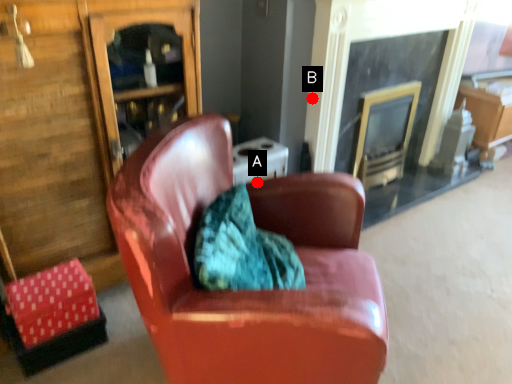
Question: Two points are circled on the image, labeled by A and B beside each circle. Which point appears farthest from the camera in this image?

Choices:
 (A) A is further
 (B) B is further

Answer: (B)